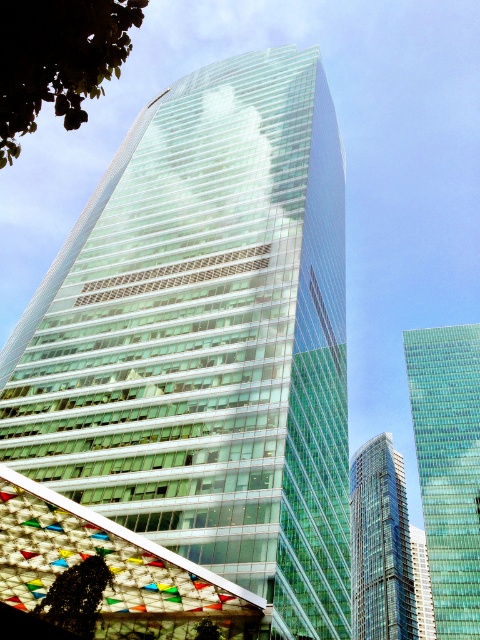
You are standing on the ground floor of the transparent glass skyscraper at upper center and want to reach the rooftop garden. The building has an elevator that can travel at 10 feet per second. How many seconds will it take to reach the rooftop garden?

The transparent glass skyscraper at upper center and viewer are 434.18 feet apart from each other. Assuming the distance between the ground floor and the rooftop garden is approximately 434.18 feet, the elevator traveling at 10 feet per second would take 43.418 seconds to reach the rooftop garden.

You are a city planner reviewing the urban landscape. You notice two green leafy trees in the scene. Which tree, the green leafy tree at upper left or the green leafy tree at lower left, has a larger size?

The green leafy tree at upper left is larger in size than the green leafy tree at lower left.

You are standing at the base of the skyscraper and notice two points marked on the glass facade. One is labeled as point [456,449] and the other as point [49,595]. Which point is closer to the top of the skyscraper?

Point [456,449] is closer to the top of the skyscraper because it is positioned higher up on the facade compared to point [49,595].